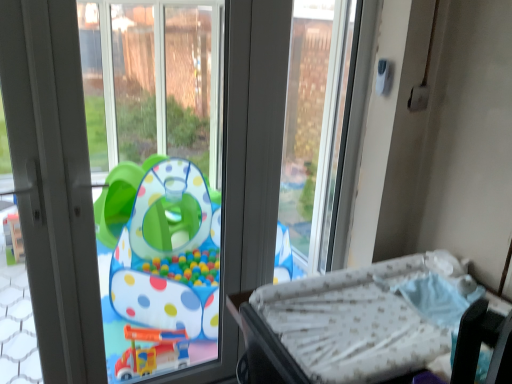
Question: From a real-world perspective, is white plastic screen door at left above or below transparent plastic playpen at center, arranged as the second window screen when viewed from the right?

Choices:
 (A) above
 (B) below

Answer: (A)

Question: From the image's perspective, is white plastic screen door at left positioned above or below transparent plastic playpen at center, arranged as the second window screen when viewed from the right?

Choices:
 (A) below
 (B) above

Answer: (B)

Question: Estimate the real-world distances between objects in this image. Which object is closer to the transparent plastic window screen at upper center, marked as the 1th window screen in a right-to-left arrangement?

Choices:
 (A) transparent plastic playpen at center, placed as the 1th window screen when sorted from left to right
 (B) white plastic screen door at left
 (C) white dotted mattress at lower right

Answer: (C)

Question: Which object is positioned farthest from the white plastic screen door at left?

Choices:
 (A) white dotted mattress at lower right
 (B) transparent plastic window screen at upper center, marked as the 1th window screen in a right-to-left arrangement
 (C) transparent plastic playpen at center, placed as the 1th window screen when sorted from left to right

Answer: (C)